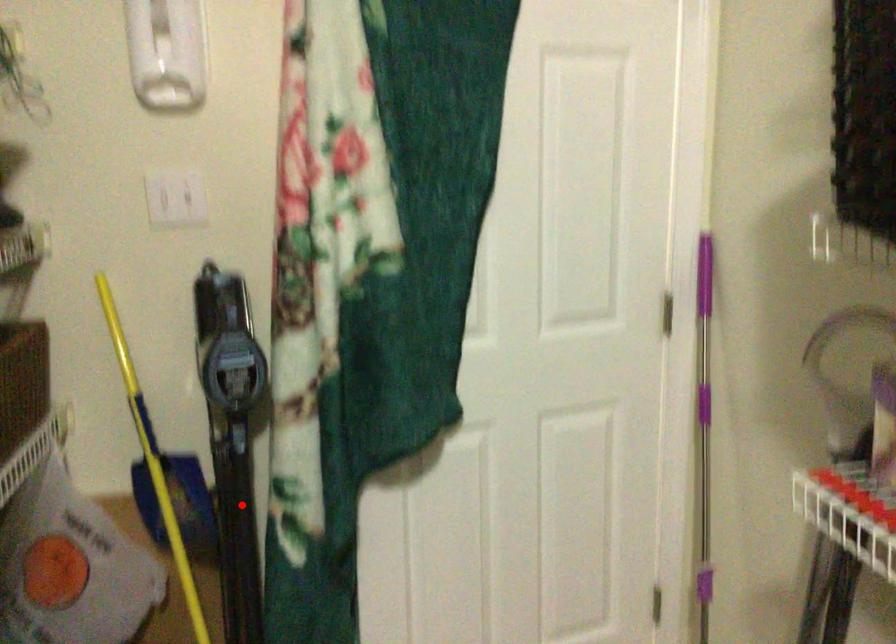
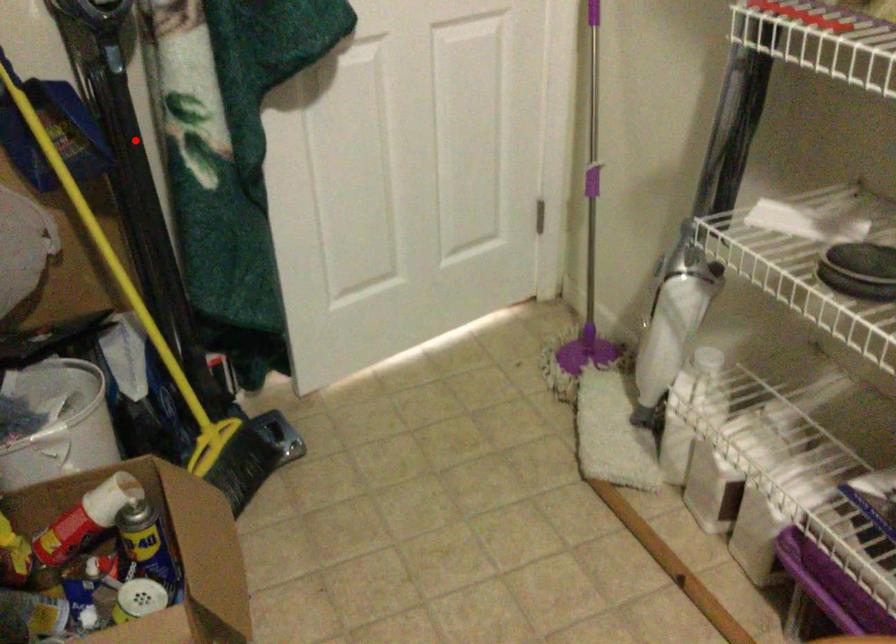
I am providing you with two images of the same scene from different viewpoints. A red point is marked on the first image and another point is marked on the second image. Is the marked point in image1 the same physical position as the marked point in image2?

Yes